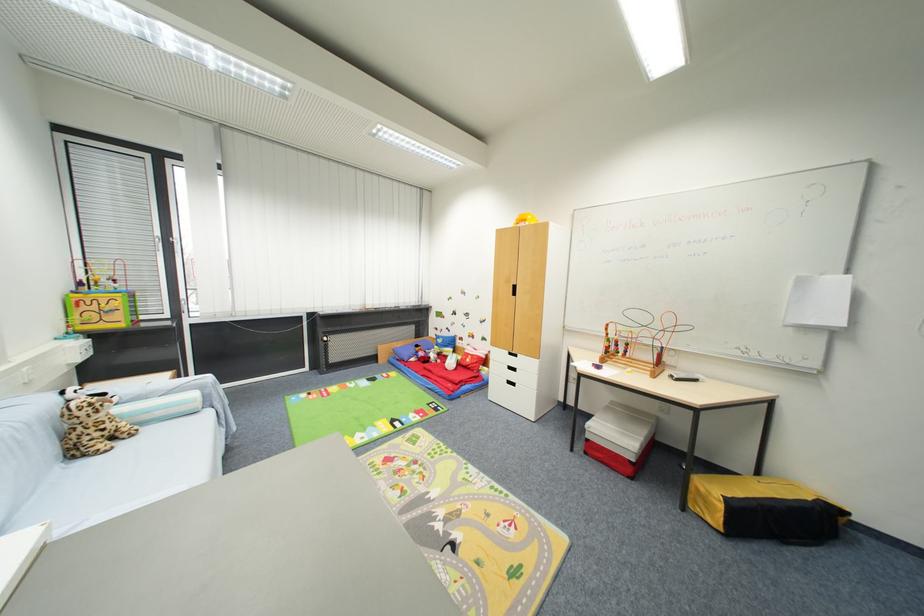
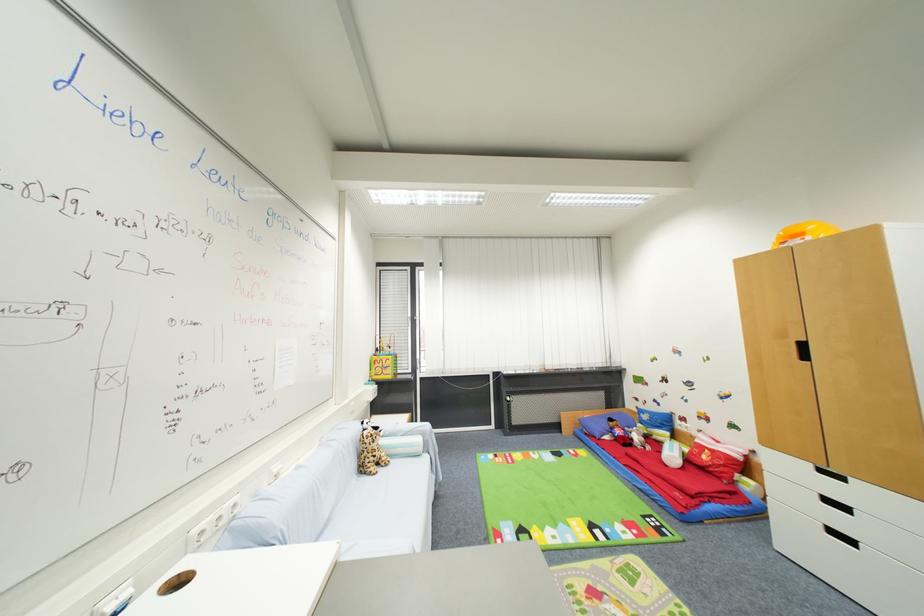
Find the pixel in the second image that matches point 518,386 in the first image.

(857, 544)